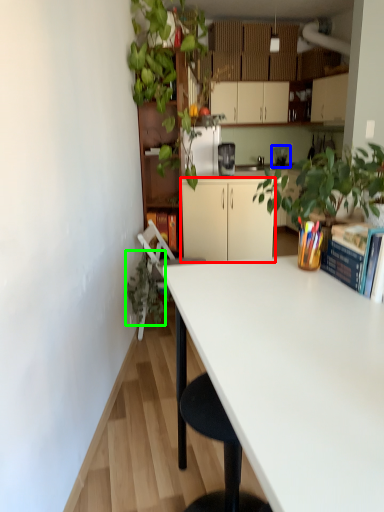
Question: Considering the real-world distances, which object is farthest from cabinetry (highlighted by a red box)? appliance (highlighted by a blue box) or vegetation (highlighted by a green box)?

Choices:
 (A) appliance
 (B) vegetation

Answer: (A)